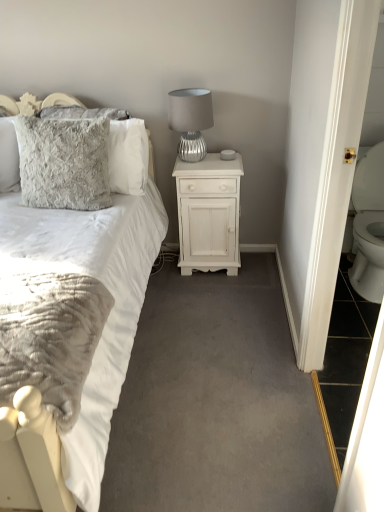
Question: Do you think fluffy gray pillow at upper left, which is counted as the 2th pillow, starting from the front, is within fuzzy gray pillow at upper left, which ranks as the first pillow in front-to-back order, or outside of it?

Choices:
 (A) outside
 (B) inside

Answer: (A)

Question: Is fluffy gray pillow at upper left, which is counted as the 2th pillow, starting from the front, in front of or behind fuzzy gray pillow at upper left, which is the 2th pillow from back to front, in the image?

Choices:
 (A) front
 (B) behind

Answer: (B)

Question: Based on their relative distances, which object is nearer to the silver textured lamp at upper right?

Choices:
 (A) fuzzy gray pillow at upper left, which is the 2th pillow from back to front
 (B) fluffy gray pillow at upper left, which is counted as the 2th pillow, starting from the front
 (C) white soft fabric bed at left
 (D) white painted wood nightstand at center

Answer: (D)

Question: Based on their relative distances, which object is farther from the white painted wood nightstand at center?

Choices:
 (A) white soft fabric bed at left
 (B) silver textured lamp at upper right
 (C) fuzzy gray pillow at upper left, which ranks as the first pillow in front-to-back order
 (D) fluffy gray pillow at upper left, which is counted as the 2th pillow, starting from the front

Answer: (A)